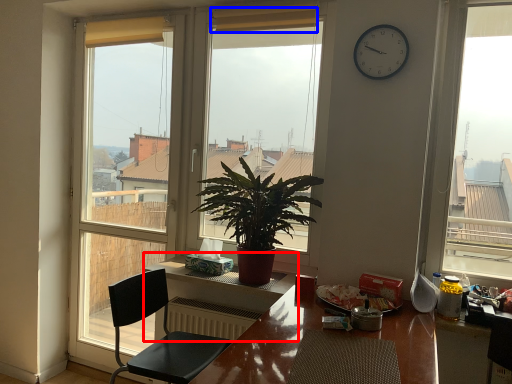
Question: Among these objects, which one is farthest to the camera, table (highlighted by a red box) or curtain (highlighted by a blue box)?

Choices:
 (A) table
 (B) curtain

Answer: (B)